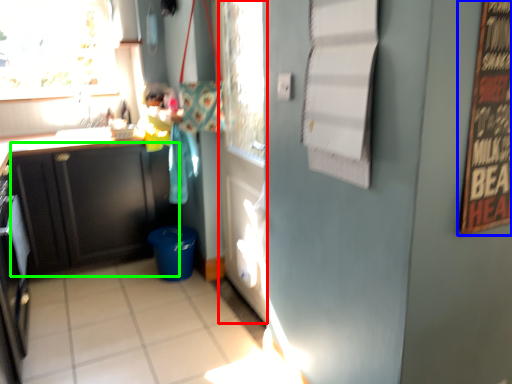
Question: Which object is positioned closest to door (highlighted by a red box)? Select from bulletin board (highlighted by a blue box) and cabinetry (highlighted by a green box).

Choices:
 (A) bulletin board
 (B) cabinetry

Answer: (B)